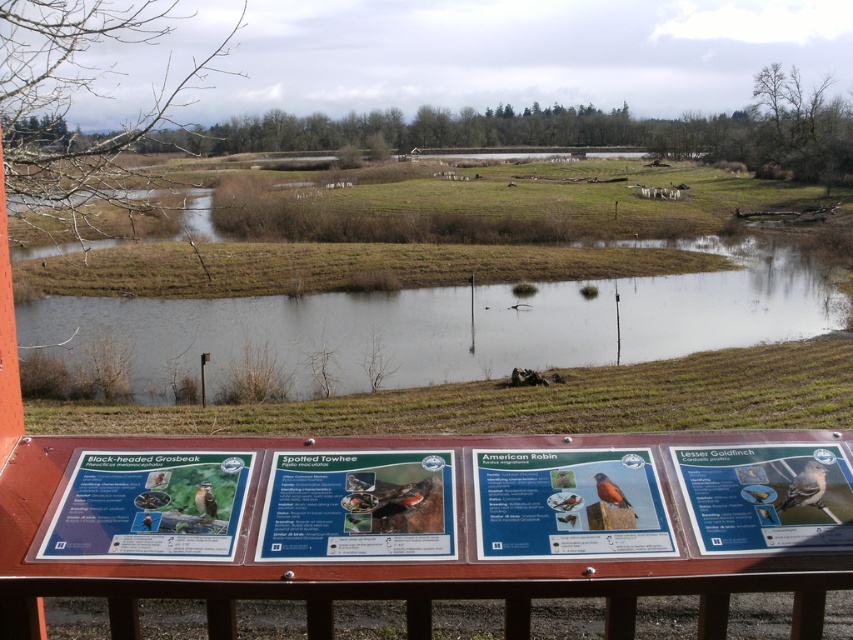
Question: Does matte plastic sign at lower left have a greater width compared to orange-brown bird at center?

Choices:
 (A) no
 (B) yes

Answer: (B)

Question: Considering the real-world distances, which object is farthest from the matte plastic american robin sign at center?

Choices:
 (A) orange-brown bird at center
 (B) brown feathered bird at lower left
 (C) brown speckled bird at lower right

Answer: (B)

Question: Can you confirm if matte plastic american robin sign at center is positioned to the left of brown feathered bird at lower left?

Choices:
 (A) yes
 (B) no

Answer: (B)

Question: Which point is farther from the camera taking this photo?

Choices:
 (A) (602, 488)
 (B) (325, 529)
 (C) (698, 502)
 (D) (212, 490)

Answer: (A)

Question: Is orange-brown bird at center bigger than brown feathered bird at lower left?

Choices:
 (A) yes
 (B) no

Answer: (A)

Question: Which point appears farthest from the camera in this image?

Choices:
 (A) (148, 490)
 (B) (535, 552)
 (C) (200, 506)
 (D) (781, 502)

Answer: (A)